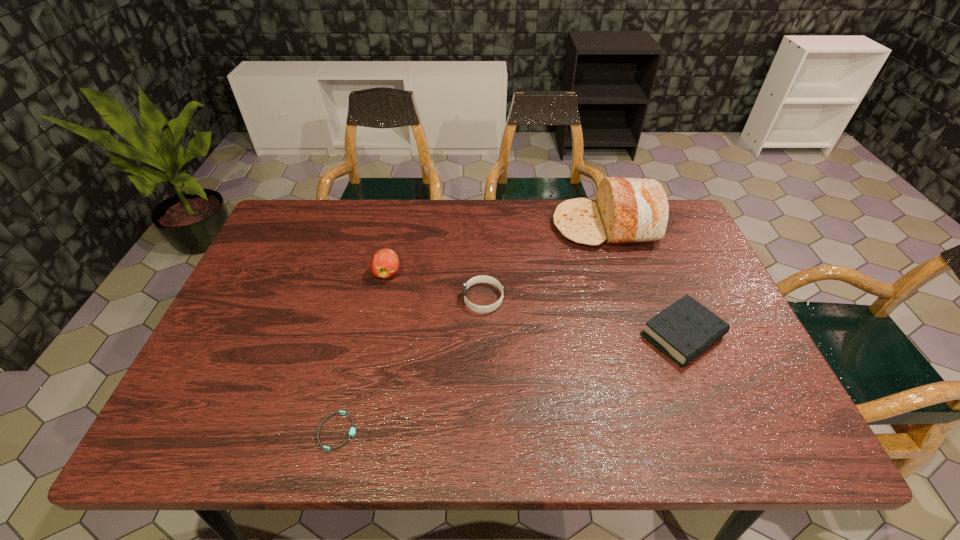
The width and height of the screenshot is (960, 540). What are the coordinates of `the farthest object` in the screenshot? It's located at (627, 210).

Where is `the tallest object`? This screenshot has height=540, width=960. the tallest object is located at coordinates (627, 210).

This screenshot has width=960, height=540. I want to click on the second tallest object, so click(384, 264).

Locate an element on the screen. Bible is located at coordinates (685, 329).

Find the location of a particular element. The height and width of the screenshot is (540, 960). the right wristband is located at coordinates (482, 278).

Where is `the taller wristband`? This screenshot has width=960, height=540. the taller wristband is located at coordinates (482, 278).

Locate an element on the screen. The height and width of the screenshot is (540, 960). the nearest object is located at coordinates (352, 431).

Find the location of a particular element. The image size is (960, 540). the nearer wristband is located at coordinates (352, 431).

What are the coordinates of `free point located 0.060m at the sliced end of the tallest object` in the screenshot? It's located at (534, 226).

You are a GUI agent. You are given a task and a screenshot of the screen. Output one action in this format:
    pyautogui.click(x=<x>, y=<y>)
    Task: Click on the vacant space situated 0.320m at the sliced end of the tallest object
    This screenshot has height=540, width=960.
    Given the screenshot: What is the action you would take?
    pyautogui.click(x=451, y=226)